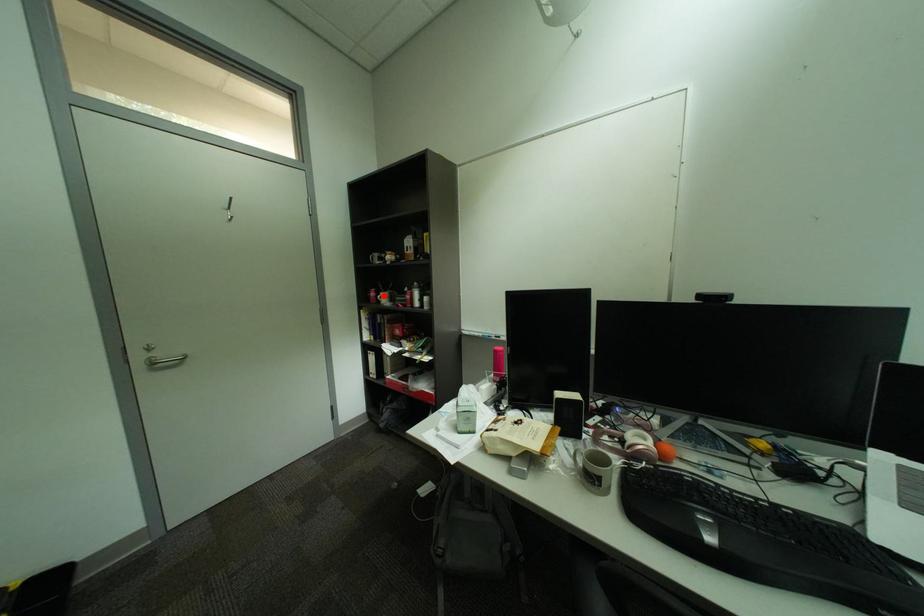
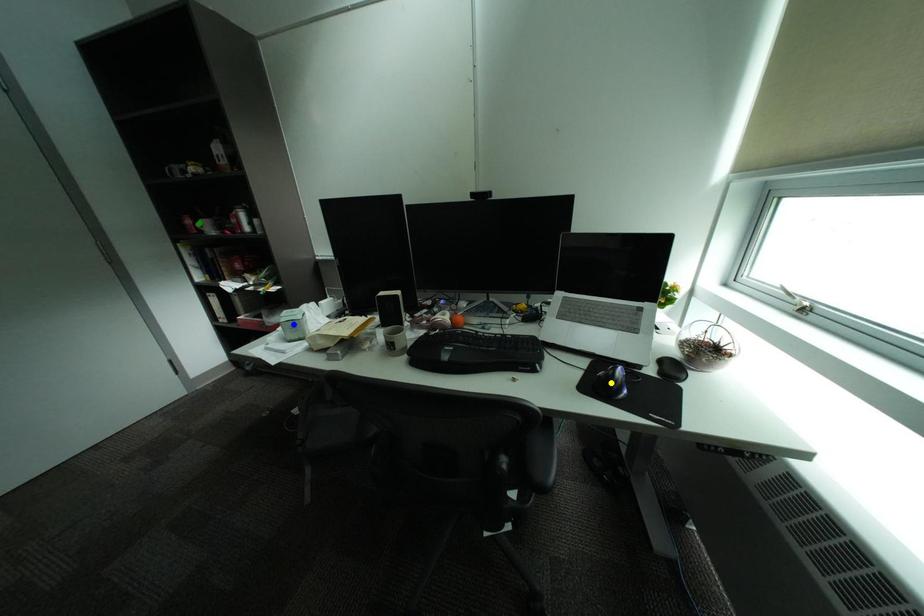
Question: I am providing you with two images of the same scene from different viewpoints. A red point is marked on the first image. You are given multiple points on the second image. Which mark in image 2 goes with the point in image 1?

Choices:
 (A) yellow point
 (B) blue point
 (C) green point

Answer: (C)